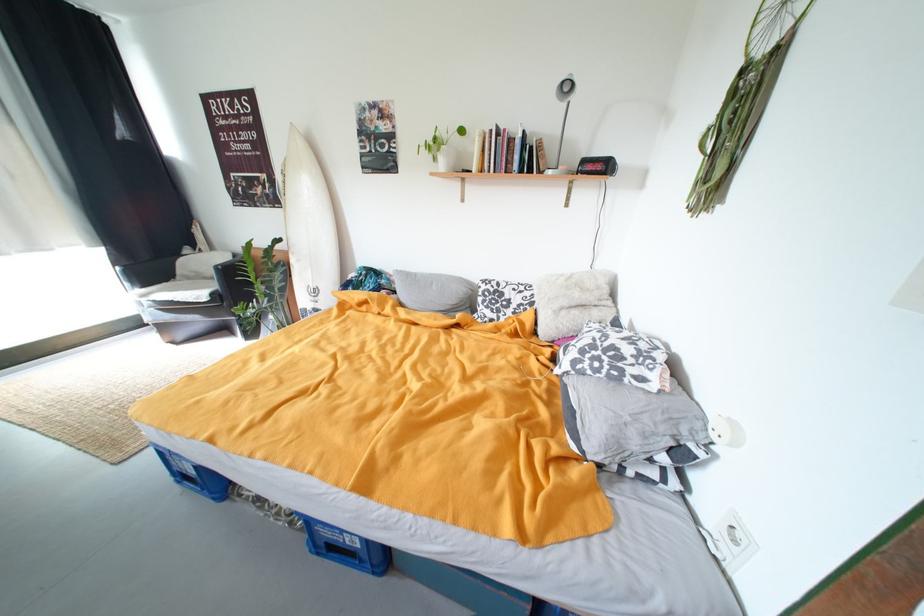
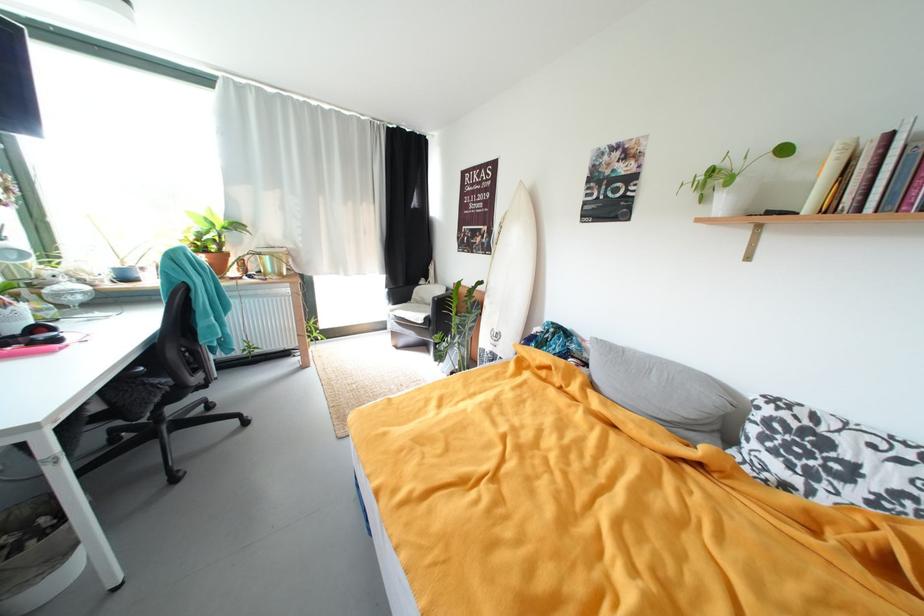
The point at (482, 171) is marked in the first image. Where is the corresponding point in the second image?

(817, 209)